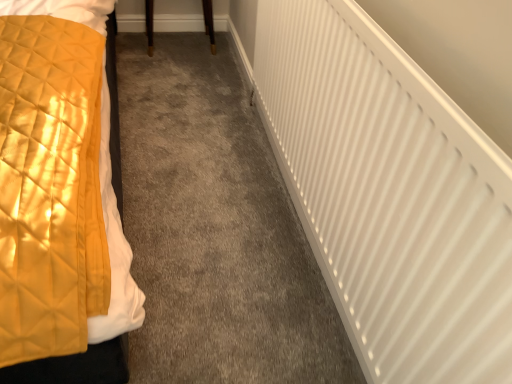
Question: In the image, is white matte radiator at right on the left side or the right side of brown wood table at upper center?

Choices:
 (A) right
 (B) left

Answer: (A)

Question: From the image's perspective, relative to brown wood table at upper center, is white matte radiator at right above or below?

Choices:
 (A) below
 (B) above

Answer: (A)

Question: Is white matte radiator at right wider or thinner than brown wood table at upper center?

Choices:
 (A) thin
 (B) wide

Answer: (A)

Question: In terms of height, does brown wood table at upper center look taller or shorter compared to white matte radiator at right?

Choices:
 (A) short
 (B) tall

Answer: (A)

Question: Would you say brown wood table at upper center is inside or outside white matte radiator at right?

Choices:
 (A) outside
 (B) inside

Answer: (A)

Question: Considering the positions of brown wood table at upper center and white matte radiator at right in the image, is brown wood table at upper center bigger or smaller than white matte radiator at right?

Choices:
 (A) small
 (B) big

Answer: (A)

Question: Considering the positions of brown wood table at upper center and white matte radiator at right in the image, is brown wood table at upper center wider or thinner than white matte radiator at right?

Choices:
 (A) wide
 (B) thin

Answer: (A)